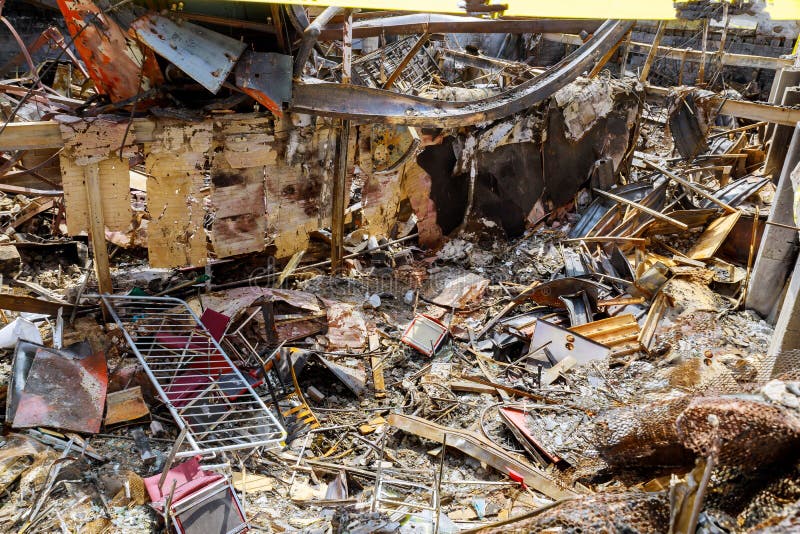
At what (x,y) coordinates should I click in order to perform the action: click on former wall. Please return your answer as a coordinate pair (x, y). Looking at the image, I should click on (110, 189), (166, 196), (298, 188), (242, 196).